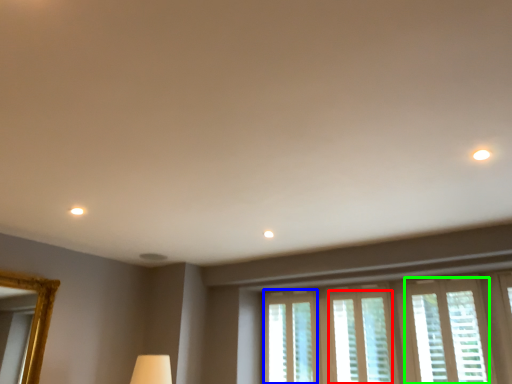
Question: Which object is positioned farthest from window (highlighted by a red box)? Select from window (highlighted by a blue box) and window (highlighted by a green box).

Choices:
 (A) window
 (B) window

Answer: (A)